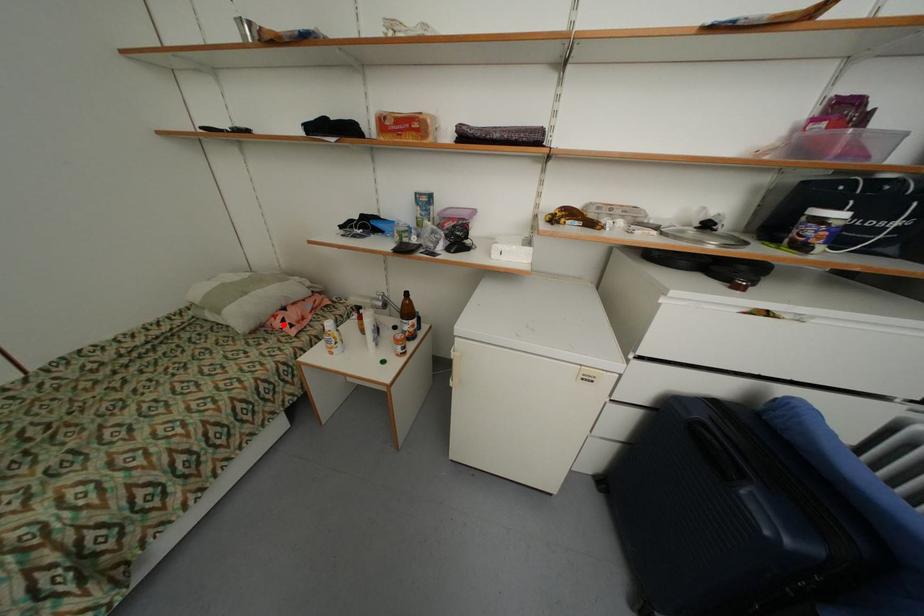
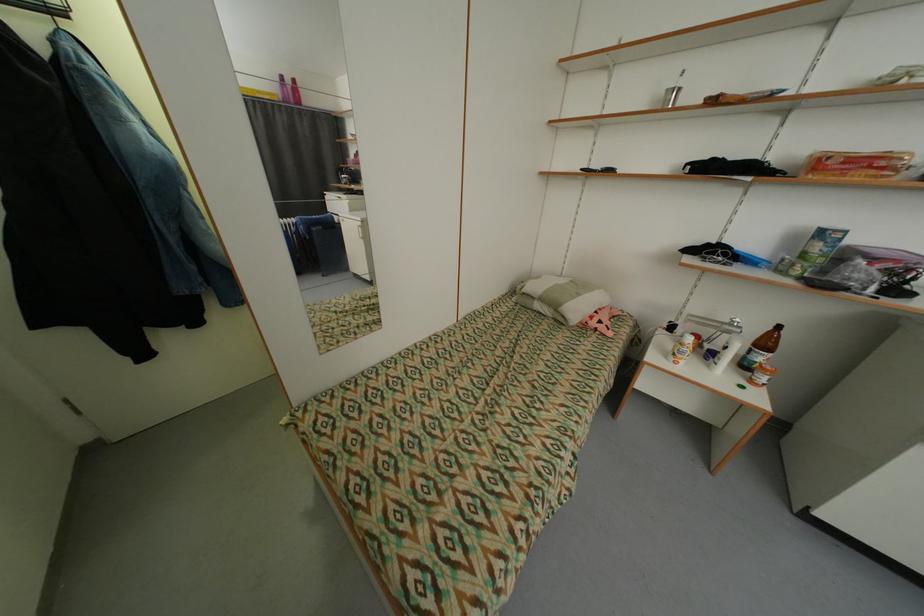
In the second image, find the point that corresponds to the highlighted location in the first image.

(600, 323)